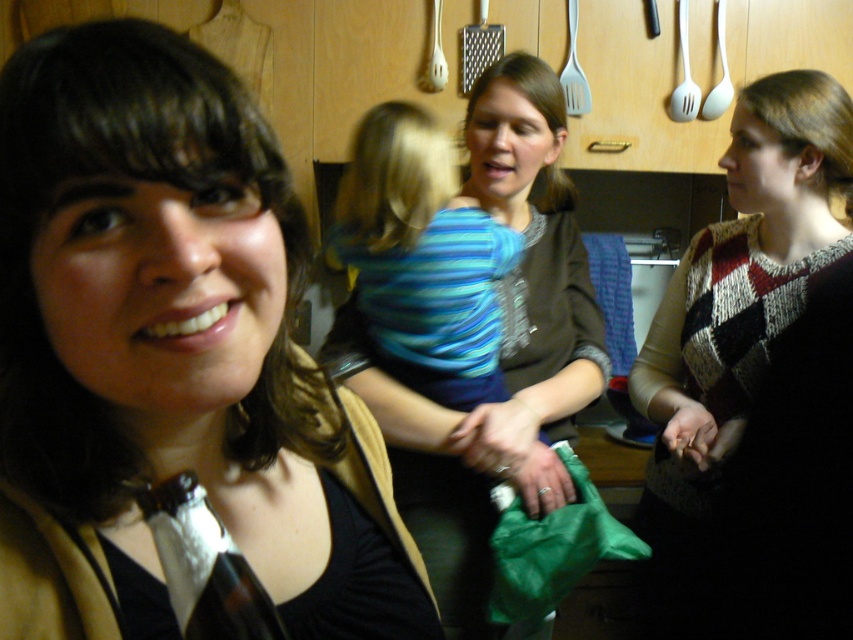
Looking at this image, who is higher up, matte black jacket at left or matte brown sweater at center?

matte brown sweater at center is higher up.

Who is shorter, matte black jacket at left or matte brown sweater at center?

matte black jacket at left is shorter.

The image size is (853, 640). What do you see at coordinates (169, 353) in the screenshot? I see `matte black jacket at left` at bounding box center [169, 353].

Where is `matte black jacket at left`? The image size is (853, 640). matte black jacket at left is located at coordinates (169, 353).

Can you confirm if matte black jacket at left is smaller than knitted sweater at center?

Correct, matte black jacket at left occupies less space than knitted sweater at center.

Is point (57, 140) positioned behind point (689, 340)?

No, it is not.

Image resolution: width=853 pixels, height=640 pixels. What are the coordinates of `matte black jacket at left` in the screenshot? It's located at (169, 353).

How distant is matte brown sweater at center from knitted sweater at center?

The distance of matte brown sweater at center from knitted sweater at center is 27.79 centimeters.

Who is more forward, (587, 304) or (706, 621)?

Point (706, 621)

Who is more forward, (532, 134) or (740, 365)?

Point (740, 365) is in front.

You are a GUI agent. You are given a task and a screenshot of the screen. Output one action in this format:
    pyautogui.click(x=<x>, y=<y>)
    Task: Click on the matte brown sweater at center
    This screenshot has width=853, height=640.
    Given the screenshot: What is the action you would take?
    pyautogui.click(x=502, y=355)